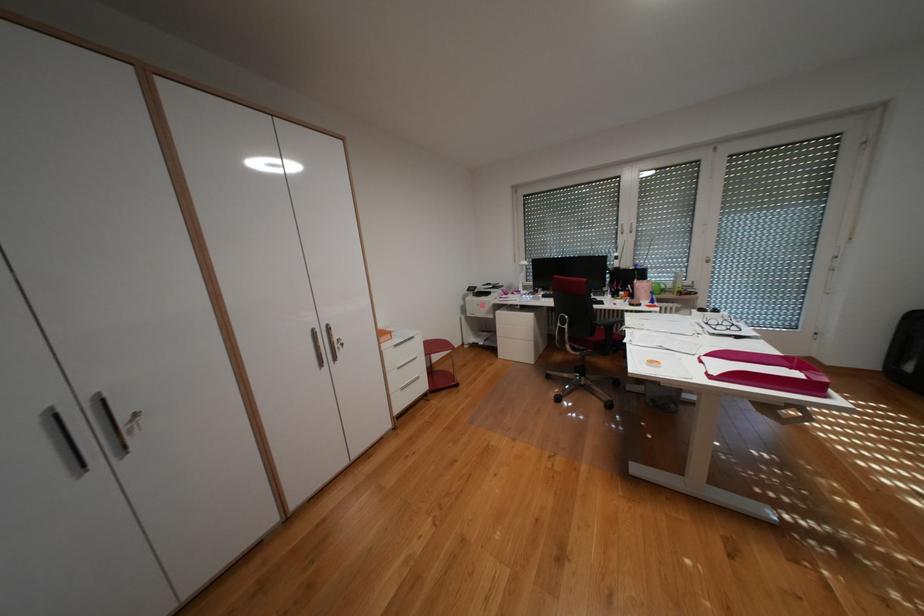
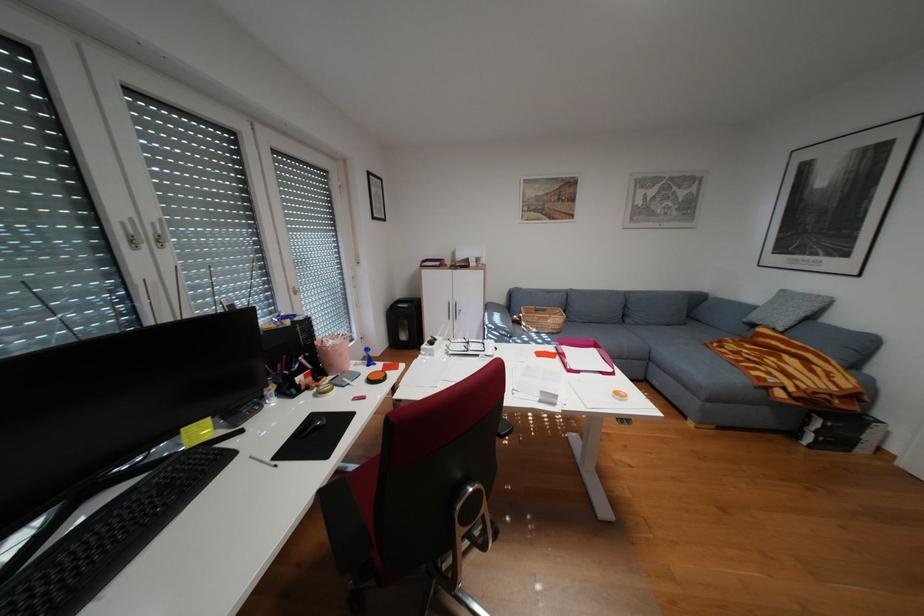
In the second image, find the point that corresponds to (713,361) in the first image.

(590, 371)